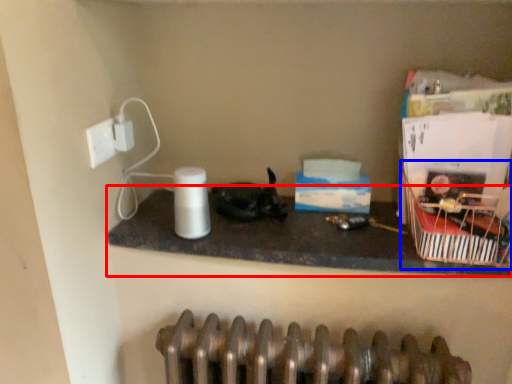
Question: Which object is further to the camera taking this photo, counter top (highlighted by a red box) or basket (highlighted by a blue box)?

Choices:
 (A) counter top
 (B) basket

Answer: (A)